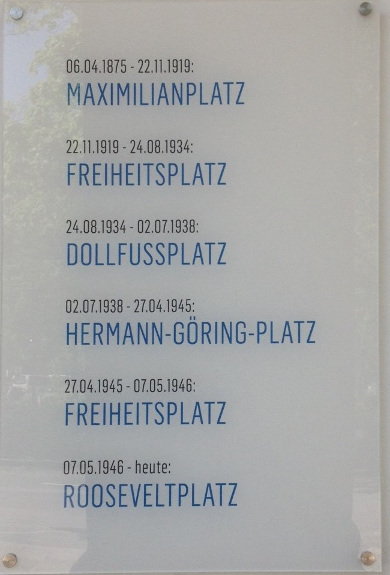
Identify the location of light. (369, 521).